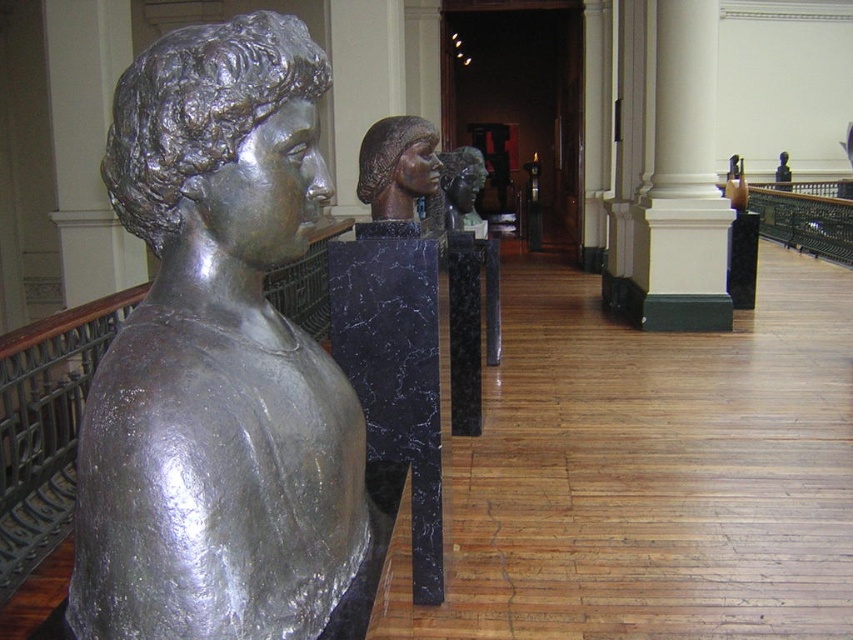
Is shiny silver bust at left to the left of bronze sculpture at center from the viewer's perspective?

Yes, shiny silver bust at left is to the left of bronze sculpture at center.

Is shiny silver bust at left to the right of bronze sculpture at center from the viewer's perspective?

In fact, shiny silver bust at left is to the left of bronze sculpture at center.

The image size is (853, 640). What do you see at coordinates (218, 358) in the screenshot? I see `shiny silver bust at left` at bounding box center [218, 358].

At what (x,y) coordinates should I click in order to perform the action: click on shiny silver bust at left. Please return your answer as a coordinate pair (x, y). The width and height of the screenshot is (853, 640). Looking at the image, I should click on (218, 358).

Which is below, bronze sculpture at center or polished bronze bust at center?

bronze sculpture at center

Can you confirm if bronze sculpture at center is smaller than polished bronze bust at center?

Yes, bronze sculpture at center is smaller than polished bronze bust at center.

You are a GUI agent. You are given a task and a screenshot of the screen. Output one action in this format:
    pyautogui.click(x=<x>, y=<y>)
    Task: Click on the bronze sculpture at center
    Image resolution: width=853 pixels, height=640 pixels.
    Given the screenshot: What is the action you would take?
    pyautogui.click(x=398, y=168)

Does point (149, 460) lie behind point (469, 148)?

No, it is not.

I want to click on shiny silver bust at left, so click(218, 358).